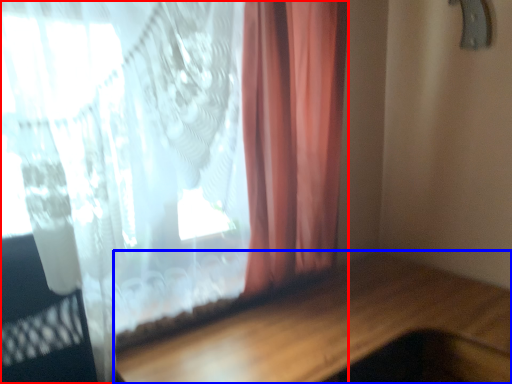
Question: Which object appears farthest to the camera in this image, curtain (highlighted by a red box) or table (highlighted by a blue box)?

Choices:
 (A) curtain
 (B) table

Answer: (A)